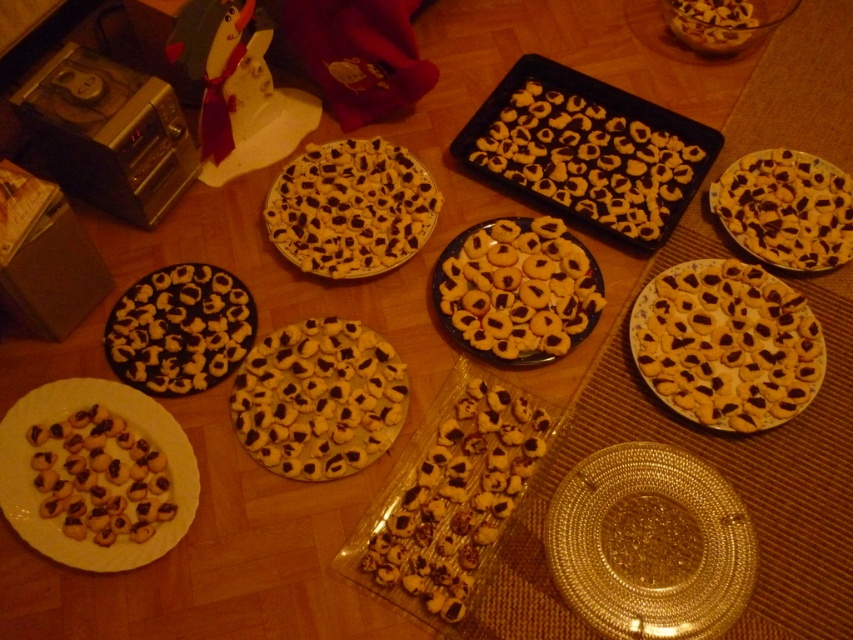
You are at a bakery table and see two types of cookies. The white matte cookies at center and the brown matte cookies at lower left. Which one is positioned to the right side of the other?

The white matte cookies at center is to the right of brown matte cookies at lower left.